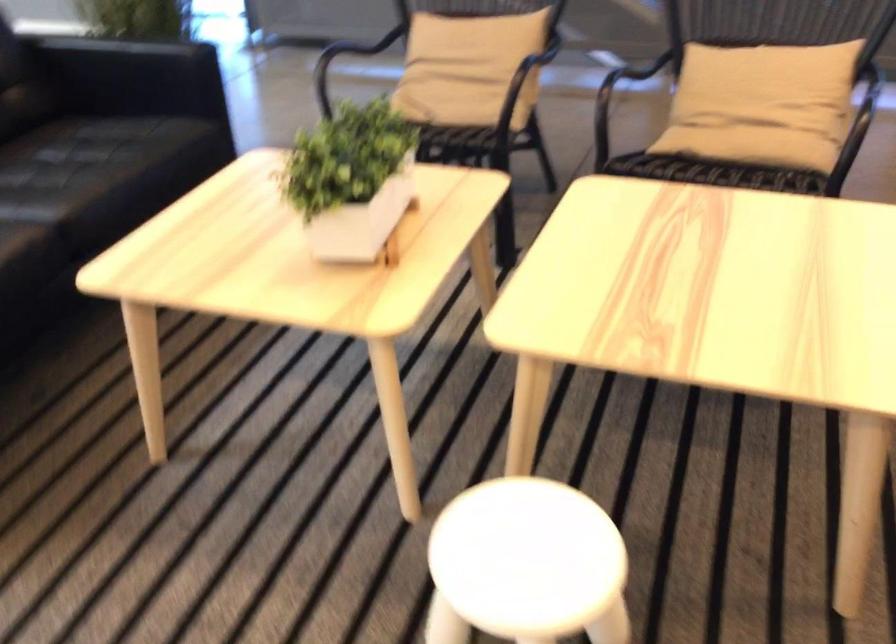
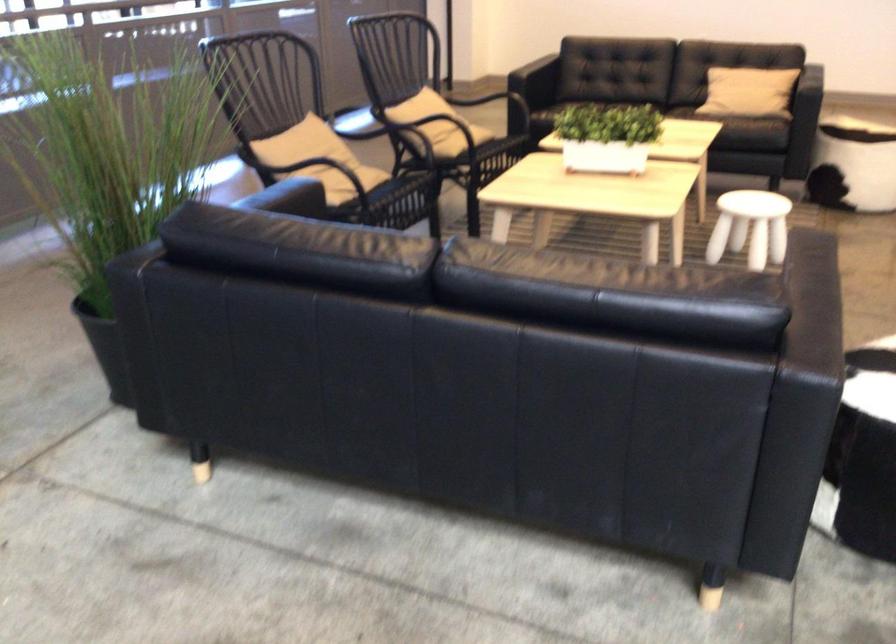
Locate, in the second image, the point that corresponds to point (682, 137) in the first image.

(462, 140)